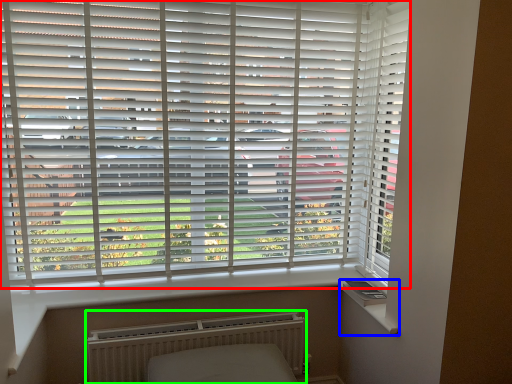
Question: Which is farther away from window blind (highlighted by a red box)? window sill (highlighted by a blue box) or radiator (highlighted by a green box)?

Choices:
 (A) window sill
 (B) radiator

Answer: (A)